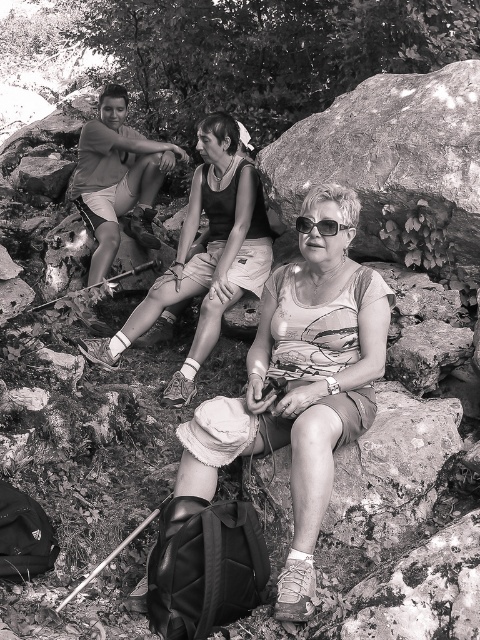
You are trying to locate the matte black tank top at center in the scene. Based on the coordinates provided in the Objects Description, where would you look relative to the older woman wearing sunglasses?

The matte black tank top at center is located at point coordinates 0.400 in the x and 0.429 in the y, which would place it near the older woman wearing sunglasses, as the center coordinates typically align with her position in the image.